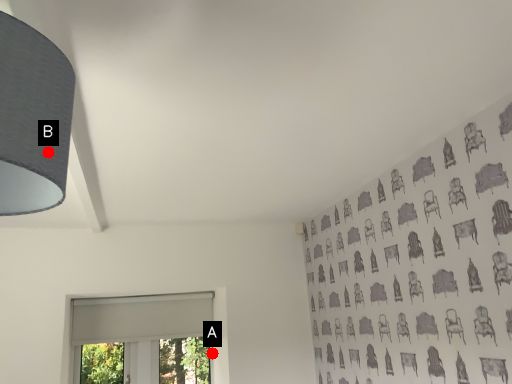
Question: Two points are circled on the image, labeled by A and B beside each circle. Among these points, which one is nearest to the camera?

Choices:
 (A) A is closer
 (B) B is closer

Answer: (B)